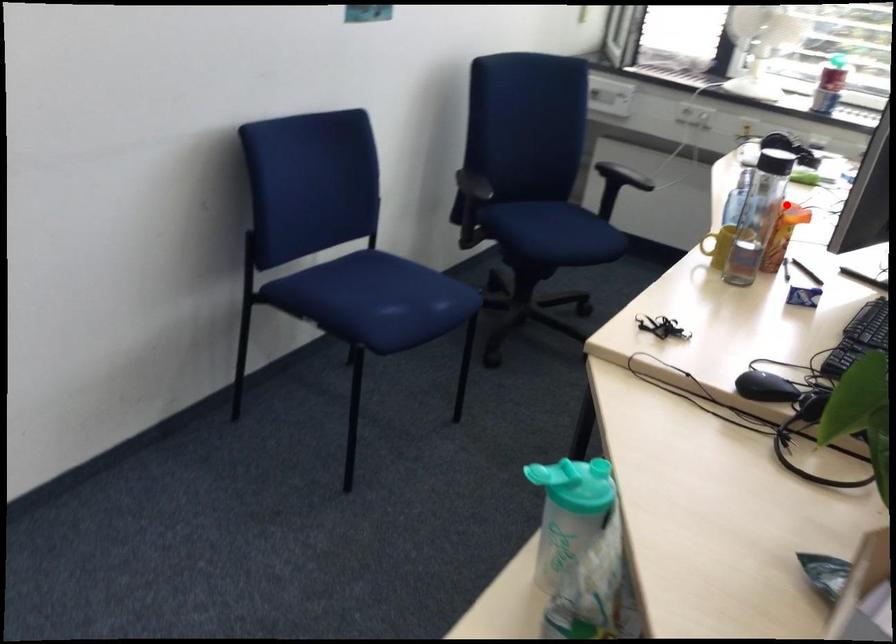
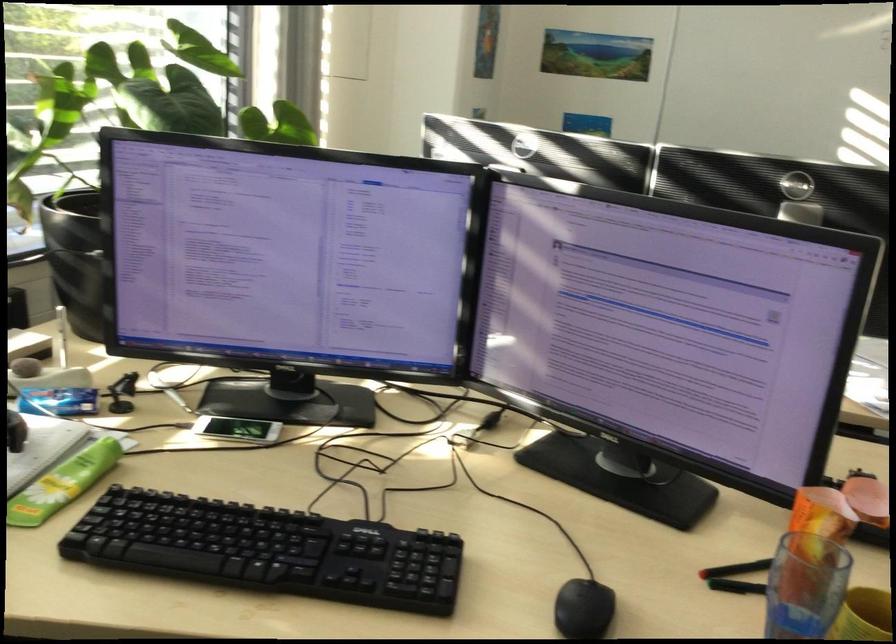
The point at the highlighted location is marked in the first image. Where is the corresponding point in the second image?

(822, 514)